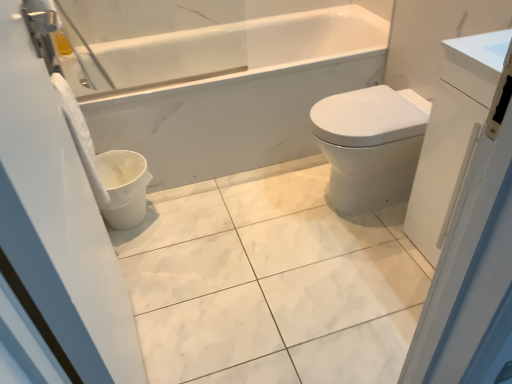
Image resolution: width=512 pixels, height=384 pixels. I want to click on vacant space that is in between white glossy screen door at left, placed as the second screen door when sorted from right to left, and white glossy toilet bowl at lower left, so click(x=147, y=278).